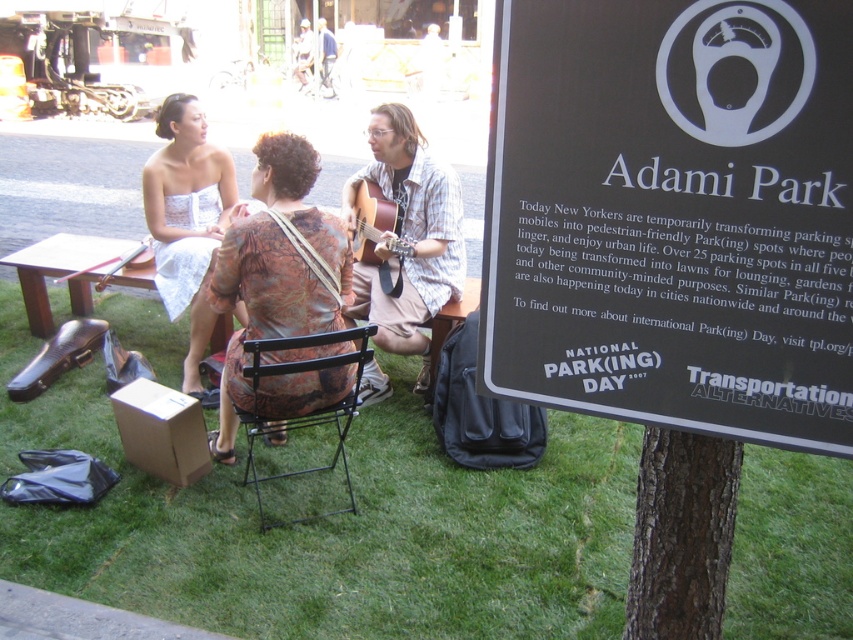
You are standing in Adami Park and want to read the text on the black plastic sign at upper right. Can you read it clearly from where you are?

The black plastic sign at upper right is 3.54 feet away from you, so yes, you can read it clearly from that distance.

You are a photographer at Adami Park and want to capture a shot of the brown textured dress at center and the white wood picnic table at lower left. Which object appears taller in the photo?

The brown textured dress at center appears taller than the white wood picnic table at lower left in the photo.